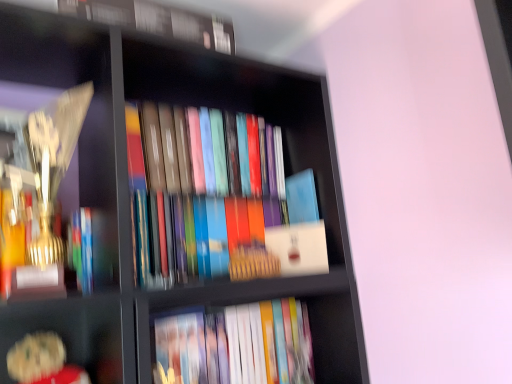
Question: Is white matte book at center, arranged as the 2th paperback book when viewed from the top, positioned before matte hardcover book at lower center, placed as the second book when sorted from top to bottom?

Choices:
 (A) yes
 (B) no

Answer: (B)

Question: Considering the relative sizes of white matte book at center, the first paperback book in the bottom-to-top sequence, and matte hardcover book at lower center, which is the 1th book in bottom-to-top order, in the image provided, is white matte book at center, the first paperback book in the bottom-to-top sequence, wider than matte hardcover book at lower center, which is the 1th book in bottom-to-top order,?

Choices:
 (A) no
 (B) yes

Answer: (A)

Question: From the image's perspective, does white matte book at center, arranged as the 2th paperback book when viewed from the top, appear higher than matte hardcover book at lower center, placed as the second book when sorted from top to bottom?

Choices:
 (A) yes
 (B) no

Answer: (A)

Question: Is white matte book at center, the first paperback book in the bottom-to-top sequence, outside matte hardcover book at lower center, placed as the second book when sorted from top to bottom?

Choices:
 (A) no
 (B) yes

Answer: (B)

Question: Is white matte book at center, the first paperback book in the bottom-to-top sequence, thinner than matte hardcover book at lower center, which is the 1th book in bottom-to-top order?

Choices:
 (A) no
 (B) yes

Answer: (B)

Question: Is white matte book at center, arranged as the 2th paperback book when viewed from the top, at the left side of matte hardcover book at lower center, placed as the second book when sorted from top to bottom?

Choices:
 (A) yes
 (B) no

Answer: (B)

Question: From the image's perspective, does hardcover book at upper center, acting as the 1th book starting from the top, appear higher than blue matte book at center, which is counted as the 2th paperback book, starting from the bottom?

Choices:
 (A) yes
 (B) no

Answer: (A)

Question: Considering the relative positions of hardcover book at upper center, acting as the 1th book starting from the top, and blue matte book at center, which is counted as the 2th paperback book, starting from the bottom, in the image provided, is hardcover book at upper center, acting as the 1th book starting from the top, behind blue matte book at center, which is counted as the 2th paperback book, starting from the bottom,?

Choices:
 (A) yes
 (B) no

Answer: (B)

Question: Can you confirm if hardcover book at upper center, which is counted as the second book, starting from the bottom, is bigger than blue matte book at center, which is counted as the 2th paperback book, starting from the bottom?

Choices:
 (A) yes
 (B) no

Answer: (A)

Question: From the image's perspective, is hardcover book at upper center, acting as the 1th book starting from the top, located beneath blue matte book at center, marked as the 1th paperback book in a top-to-bottom arrangement?

Choices:
 (A) yes
 (B) no

Answer: (B)

Question: Can you confirm if hardcover book at upper center, which is counted as the second book, starting from the bottom, is shorter than blue matte book at center, marked as the 1th paperback book in a top-to-bottom arrangement?

Choices:
 (A) no
 (B) yes

Answer: (B)

Question: Does hardcover book at upper center, acting as the 1th book starting from the top, contain blue matte book at center, which is counted as the 2th paperback book, starting from the bottom?

Choices:
 (A) no
 (B) yes

Answer: (A)

Question: Can you confirm if matte hardcover book at lower center, which is the 1th book in bottom-to-top order, is thinner than blue matte book at center, marked as the 1th paperback book in a top-to-bottom arrangement?

Choices:
 (A) yes
 (B) no

Answer: (B)